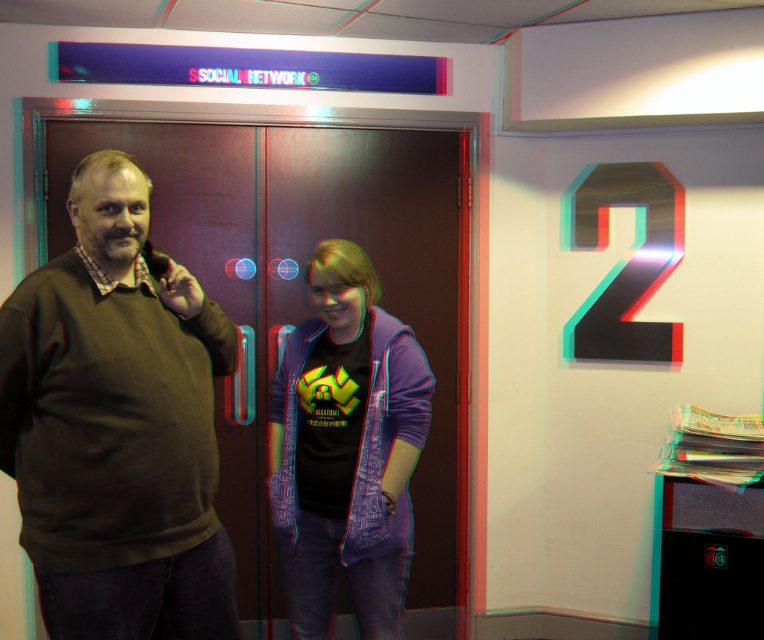
You are standing in front of the door labeled SOCIAL NETWORK. You see a brown matte sweater at left and a matte purple jacket at center. Which clothing item is more to the left?

The brown matte sweater at left is more to the left than the matte purple jacket at center.

You are a delivery robot with a 30 cm wide package. You need to navigate between the brown matte sweater at left and the matte purple jacket at center to deliver the package. Can you fit through the space between them?

The distance between the brown matte sweater at left and the matte purple jacket at center is 51.68 centimeters. Since the package is 30 cm wide, the robot can fit through the space as the available width is greater than the package size.